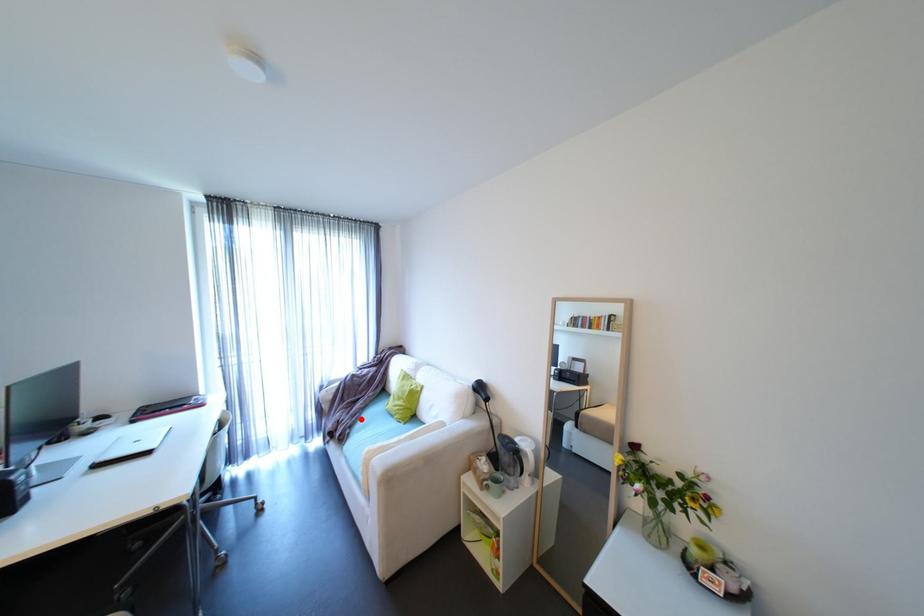
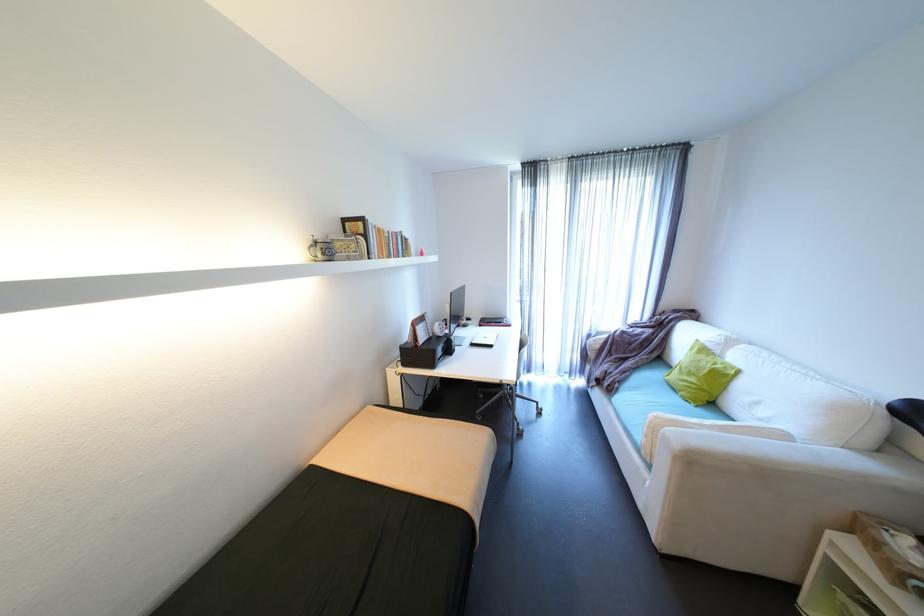
In the second image, find the point that corresponds to the highlighted location in the first image.

(630, 377)